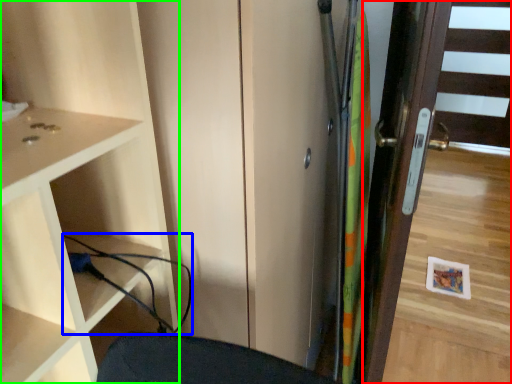
Question: Based on their relative distances, which object is nearer to door (highlighted by a red box)? Choose from cable (highlighted by a blue box) and cupboard (highlighted by a green box).

Choices:
 (A) cable
 (B) cupboard

Answer: (B)